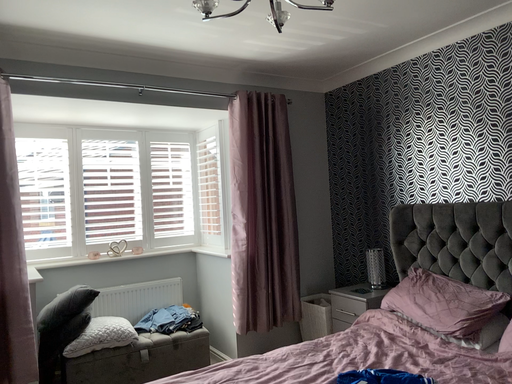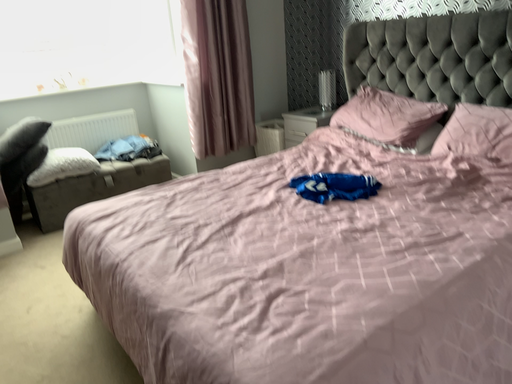
Question: How did the camera likely rotate when shooting the video?

Choices:
 (A) rotated upward
 (B) rotated downward

Answer: (B)